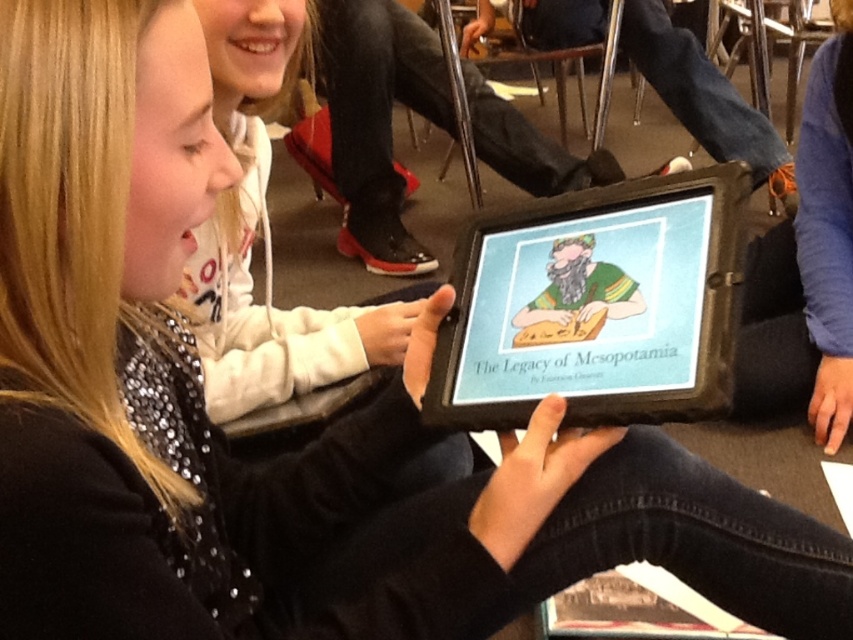
Who is more forward, (627, 339) or (263, 128)?

Point (627, 339)

Identify the location of black matte tablet at center. (596, 307).

Who is more distant from viewer, (489, 282) or (256, 65)?

Positioned behind is point (256, 65).

The width and height of the screenshot is (853, 640). I want to click on black matte tablet at center, so click(x=596, y=307).